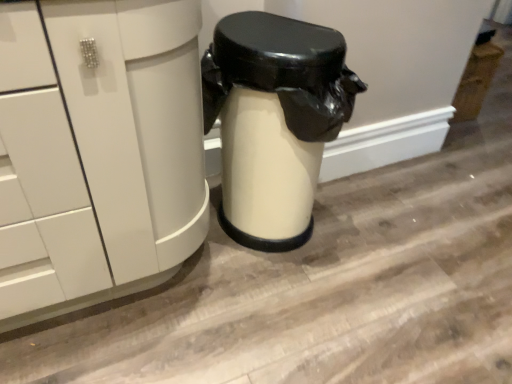
Locate an element on the screen. Image resolution: width=512 pixels, height=384 pixels. free spot below white glossy trash can at center (from a real-world perspective) is located at coordinates (301, 238).